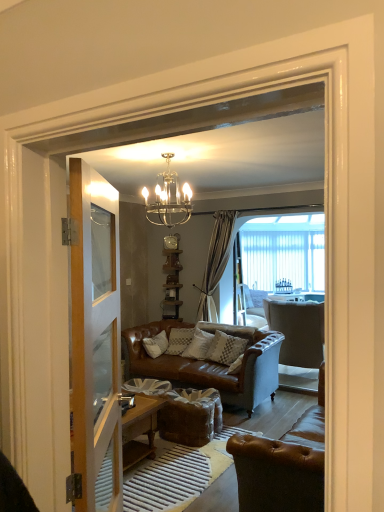
Question: Are clear glass chandelier at upper center and clear glass door at left located far from each other?

Choices:
 (A) yes
 (B) no

Answer: (A)

Question: Is clear glass chandelier at upper center placed right next to clear glass door at left?

Choices:
 (A) yes
 (B) no

Answer: (B)

Question: Does clear glass chandelier at upper center have a smaller size compared to clear glass door at left?

Choices:
 (A) no
 (B) yes

Answer: (B)

Question: From a real-world perspective, is clear glass chandelier at upper center physically below clear glass door at left?

Choices:
 (A) no
 (B) yes

Answer: (A)

Question: Can clear glass door at left be found inside clear glass chandelier at upper center?

Choices:
 (A) no
 (B) yes

Answer: (A)

Question: Can you confirm if clear glass chandelier at upper center is shorter than clear glass door at left?

Choices:
 (A) yes
 (B) no

Answer: (A)

Question: Does metallic silver clock at upper center have a greater width compared to light gray fabric armchair at center, which appears as the second chair when viewed from the front?

Choices:
 (A) no
 (B) yes

Answer: (A)

Question: From a real-world perspective, is metallic silver clock at upper center beneath light gray fabric armchair at center, the 1th chair positioned from the back?

Choices:
 (A) yes
 (B) no

Answer: (B)

Question: Is metallic silver clock at upper center positioned with its back to light gray fabric armchair at center, which appears as the second chair when viewed from the front?

Choices:
 (A) yes
 (B) no

Answer: (B)

Question: From the image's perspective, is metallic silver clock at upper center below light gray fabric armchair at center, the 1th chair positioned from the back?

Choices:
 (A) yes
 (B) no

Answer: (B)

Question: Is metallic silver clock at upper center closer to camera compared to light gray fabric armchair at center, the 1th chair positioned from the back?

Choices:
 (A) yes
 (B) no

Answer: (B)

Question: Is the depth of metallic silver clock at upper center greater than that of light gray fabric armchair at center, the 1th chair positioned from the back?

Choices:
 (A) no
 (B) yes

Answer: (B)

Question: Is clear glass door at left aimed at textured beige pillow at center?

Choices:
 (A) no
 (B) yes

Answer: (A)